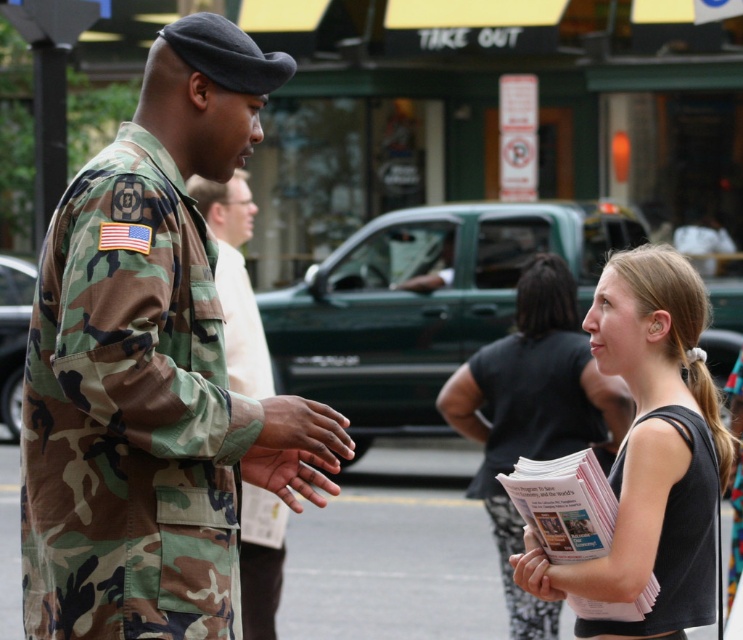
Question: Can you confirm if black tank top at right is thinner than smooth white paper at lower center?

Choices:
 (A) yes
 (B) no

Answer: (B)

Question: Can you confirm if black tank top at right is positioned to the right of camo uniform at center?

Choices:
 (A) no
 (B) yes

Answer: (B)

Question: Among these objects, which one is nearest to the camera?

Choices:
 (A) dark skin hand at center
 (B) black tank top at right
 (C) matte camouflage hand at center
 (D) black tank top at center

Answer: (C)

Question: Does black tank top at right appear on the right side of matte camouflage hand at center?

Choices:
 (A) no
 (B) yes

Answer: (B)

Question: Considering the real-world distances, which object is farthest from the camo uniform at center?

Choices:
 (A) black tank top at right
 (B) black matte uniform at lower right
 (C) smooth white paper at lower center
 (D) camouflage uniform at left

Answer: (D)

Question: Estimate the real-world distances between objects in this image. Which object is closer to the smooth white paper at lower center?

Choices:
 (A) black tank top at center
 (B) matte camouflage hand at center
 (C) black tank top at right
 (D) dark skin hand at center

Answer: (C)